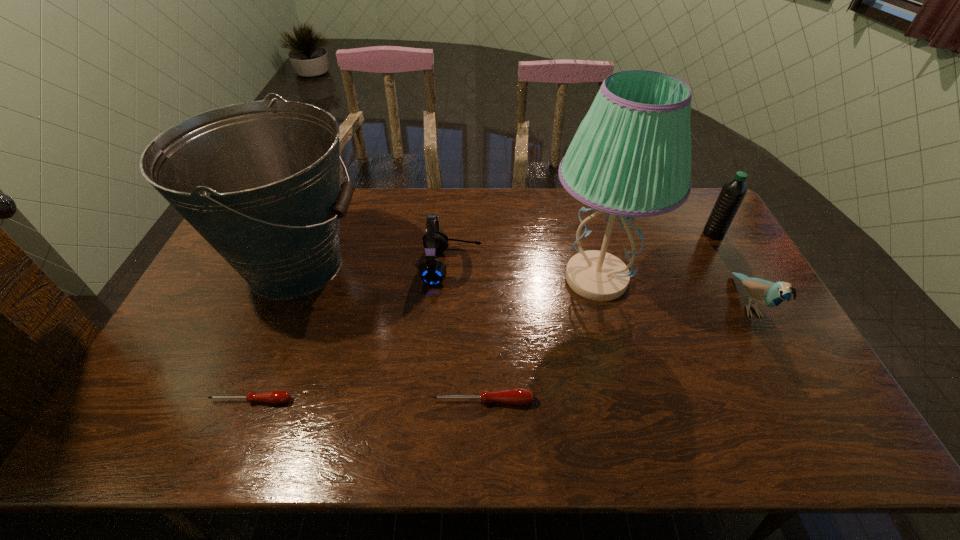
All screwdrivers are currently evenly spaced. To continue this pattern, where would you add another screwdriver on the right? Please point out a vacant spot. Please provide its 2D coordinates. Your answer should be formatted as a tuple, i.e. [(x, y)], where the tuple contains the x and y coordinates of a point satisfying the conditions above.

[(713, 401)]